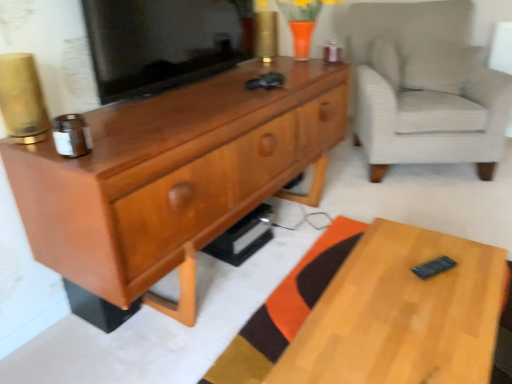
Question: Are matte black tv at center and light gray textured armchair at right making contact?

Choices:
 (A) no
 (B) yes

Answer: (A)

Question: Considering the relative positions of matte black tv at center and light gray textured armchair at right in the image provided, is matte black tv at center to the right of light gray textured armchair at right from the viewer's perspective?

Choices:
 (A) yes
 (B) no

Answer: (B)

Question: Does matte black tv at center have a greater width compared to light gray textured armchair at right?

Choices:
 (A) no
 (B) yes

Answer: (A)

Question: Does matte black tv at center have a lesser height compared to light gray textured armchair at right?

Choices:
 (A) no
 (B) yes

Answer: (B)

Question: Considering the relative sizes of matte black tv at center and light gray textured armchair at right in the image provided, is matte black tv at center smaller than light gray textured armchair at right?

Choices:
 (A) yes
 (B) no

Answer: (A)

Question: Choose the correct answer: Is matte black tv at center inside light wood desk at lower right or outside it?

Choices:
 (A) outside
 (B) inside

Answer: (A)

Question: From a real-world perspective, is matte black tv at center above or below light wood desk at lower right?

Choices:
 (A) above
 (B) below

Answer: (A)

Question: Is matte black tv at center in front of or behind light wood desk at lower right in the image?

Choices:
 (A) front
 (B) behind

Answer: (B)

Question: Is point (108, 14) closer or farther from the camera than point (418, 362)?

Choices:
 (A) closer
 (B) farther

Answer: (B)

Question: From a real-world perspective, is matte black tv at center positioned above or below matte wood cabinet at center?

Choices:
 (A) below
 (B) above

Answer: (B)

Question: Visually, is matte black tv at center positioned to the left or to the right of matte wood cabinet at center?

Choices:
 (A) left
 (B) right

Answer: (A)

Question: Considering the positions of matte black tv at center and matte wood cabinet at center in the image, is matte black tv at center wider or thinner than matte wood cabinet at center?

Choices:
 (A) wide
 (B) thin

Answer: (B)

Question: Is matte black tv at center spatially inside matte wood cabinet at center, or outside of it?

Choices:
 (A) outside
 (B) inside

Answer: (A)

Question: Is light wood desk at lower right spatially inside matte wood cabinet at center, or outside of it?

Choices:
 (A) inside
 (B) outside

Answer: (B)

Question: Looking at their shapes, would you say light wood desk at lower right is wider or thinner than matte wood cabinet at center?

Choices:
 (A) thin
 (B) wide

Answer: (B)